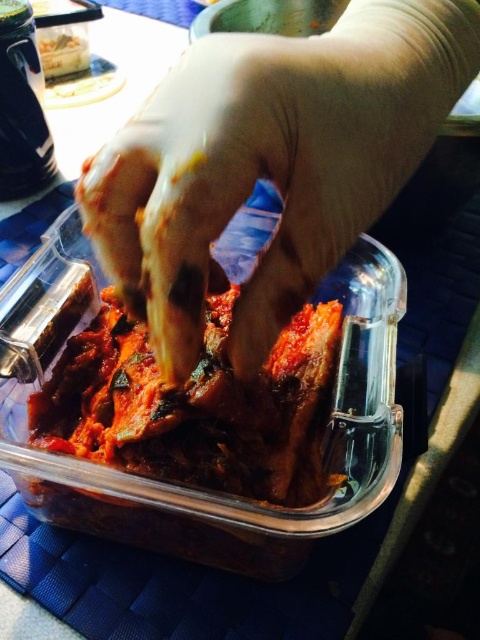
Find the location of a particular element. This screenshot has width=480, height=640. gloved hand at center is located at coordinates (269, 163).

Which is more to the left, gloved hand at center or dark red glossy kimchi at center?

dark red glossy kimchi at center is more to the left.

Between point (360, 13) and point (301, 396), which one is positioned in front?

Positioned in front is point (360, 13).

This screenshot has height=640, width=480. I want to click on gloved hand at center, so click(269, 163).